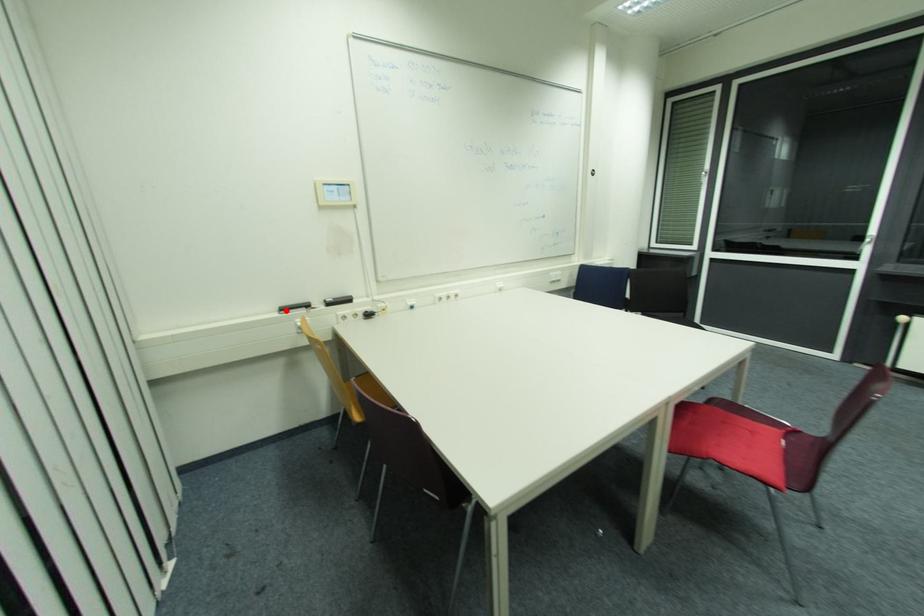
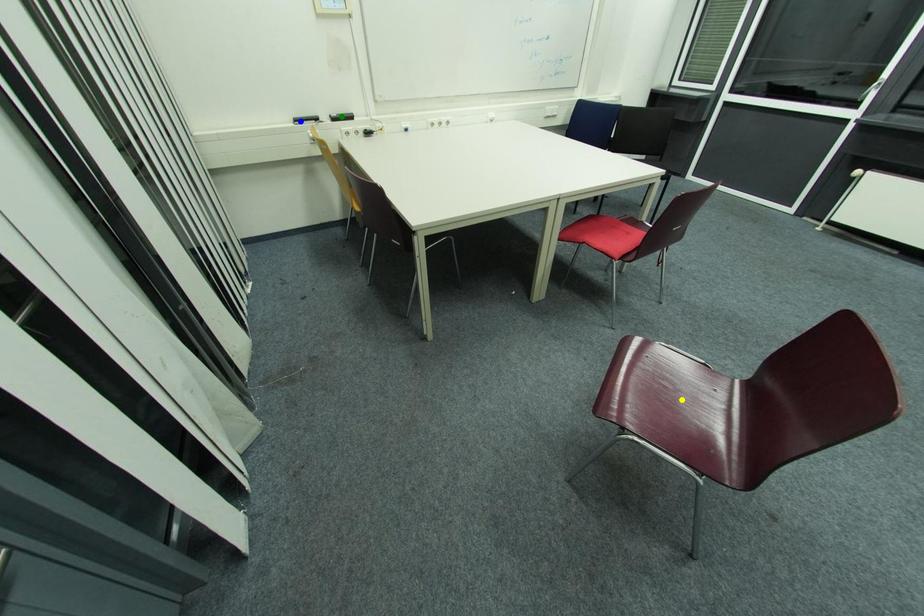
Question: I am providing you with two images of the same scene from different viewpoints. A red point is marked on the first image. You are given multiple points on the second image. Which point in image 2 is actually the same real-world point as the red point in image 1?

Choices:
 (A) blue point
 (B) yellow point
 (C) green point

Answer: (A)